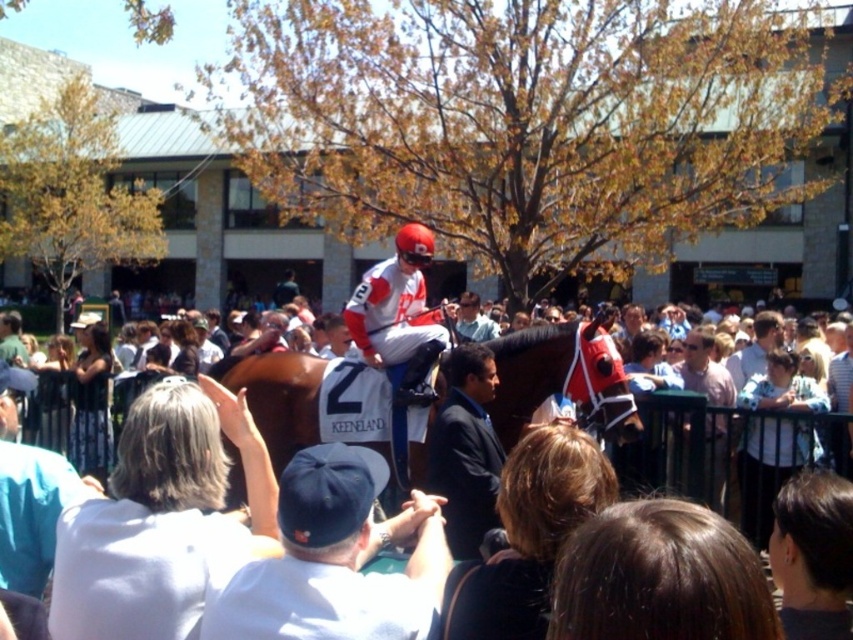
Is black suit at center to the right of matte red helmet at center from the viewer's perspective?

Indeed, black suit at center is positioned on the right side of matte red helmet at center.

Which is more to the right, black suit at center or matte red helmet at center?

black suit at center

Image resolution: width=853 pixels, height=640 pixels. Identify the location of black suit at center. (466, 449).

Find the location of `black suit at center`. black suit at center is located at coordinates (466, 449).

Does white fabric crowd at center have a smaller size compared to light pink shirt at center?

Actually, white fabric crowd at center might be larger than light pink shirt at center.

Is point (665, 476) behind point (720, 435)?

No, it is not.

Find the location of a particular element. The image size is (853, 640). white fabric crowd at center is located at coordinates (730, 451).

Who is shorter, white cotton cap at center or light brown leather jacket at center?

Standing shorter between the two is light brown leather jacket at center.

Does white cotton cap at center have a lesser height compared to light brown leather jacket at center?

In fact, white cotton cap at center may be taller than light brown leather jacket at center.

Does point (355, 556) lie in front of point (752, 369)?

Yes, it is.

I want to click on white cotton cap at center, so click(x=334, y=560).